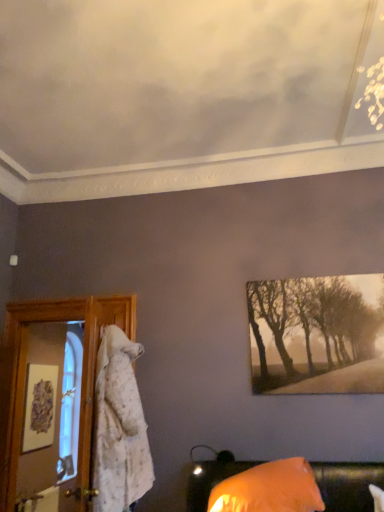
In order to face orange fabric pillow at lower right, should I rotate leftwards or rightwards?

You should look right and rotate roughly 8.987 degrees.

You are a GUI agent. You are given a task and a screenshot of the screen. Output one action in this format:
    pyautogui.click(x=<x>, y=<y>)
    Task: Click on the sepia-toned canvas at upper right
    The height and width of the screenshot is (512, 384).
    Given the screenshot: What is the action you would take?
    pyautogui.click(x=317, y=335)

Locate an element on the screen. matte white picture frame at left is located at coordinates (40, 407).

The image size is (384, 512). I want to click on furniture on the left side of sepia-toned canvas at upper right, so click(346, 484).

Does sepia-toned canvas at upper right have a greater width compared to orange fabric pillow at lower right?

Incorrect, the width of sepia-toned canvas at upper right does not surpass that of orange fabric pillow at lower right.

Measure the distance from sepia-toned canvas at upper right to orange fabric pillow at lower right.

sepia-toned canvas at upper right and orange fabric pillow at lower right are 30.37 inches apart.

Who is taller, sepia-toned canvas at upper right or orange fabric pillow at lower right?

sepia-toned canvas at upper right.

Who is bigger, matte white picture frame at left or sepia-toned canvas at upper right?

With larger size is sepia-toned canvas at upper right.

Could you tell me if matte white picture frame at left is turned towards sepia-toned canvas at upper right?

Yes, matte white picture frame at left is aimed at sepia-toned canvas at upper right.

Is matte white picture frame at left far away from sepia-toned canvas at upper right?

Absolutely, matte white picture frame at left is distant from sepia-toned canvas at upper right.

Locate an element on the screen. picture frame that appears behind the sepia-toned canvas at upper right is located at coordinates (40, 407).

Find the location of a particular element. Image resolution: width=384 pixels, height=512 pixels. tree above the matte white picture frame at left (from a real-world perspective) is located at coordinates (317, 335).

Is sepia-toned canvas at upper right located outside matte white picture frame at left?

Yes.

Are sepia-toned canvas at upper right and matte white picture frame at left located far from each other?

Yes, sepia-toned canvas at upper right and matte white picture frame at left are quite far apart.

Considering the relative sizes of orange fabric pillow at lower right and sepia-toned canvas at upper right in the image provided, is orange fabric pillow at lower right wider than sepia-toned canvas at upper right?

Yes, orange fabric pillow at lower right is wider than sepia-toned canvas at upper right.

From a real-world perspective, which object stands above the other?

sepia-toned canvas at upper right.

How different are the orientations of orange fabric pillow at lower right and sepia-toned canvas at upper right in degrees?

They differ by 0.468 degrees in their facing directions.

Are orange fabric pillow at lower right and sepia-toned canvas at upper right beside each other?

They are not placed beside each other.

How distant is orange fabric pillow at lower right from matte white picture frame at left?

orange fabric pillow at lower right is 8.03 feet away from matte white picture frame at left.

From a real-world perspective, is orange fabric pillow at lower right positioned over matte white picture frame at left based on gravity?

No, from a real-world perspective, orange fabric pillow at lower right is not on top of matte white picture frame at left.

Considering the relative positions of orange fabric pillow at lower right and matte white picture frame at left in the image provided, is orange fabric pillow at lower right to the left of matte white picture frame at left from the viewer's perspective?

In fact, orange fabric pillow at lower right is to the right of matte white picture frame at left.

Identify the location of picture frame behind the orange fabric pillow at lower right. (40, 407).

Could you tell me if matte white picture frame at left is turned towards orange fabric pillow at lower right?

No, matte white picture frame at left does not turn towards orange fabric pillow at lower right.

Can you confirm if matte white picture frame at left is taller than orange fabric pillow at lower right?

Correct, matte white picture frame at left is much taller as orange fabric pillow at lower right.

Can you confirm if matte white picture frame at left is thinner than orange fabric pillow at lower right?

Yes.

Find the location of a particular element. This screenshot has width=384, height=512. furniture in front of the matte white picture frame at left is located at coordinates (346, 484).

You are a GUI agent. You are given a task and a screenshot of the screen. Output one action in this format:
    pyautogui.click(x=<x>, y=<y>)
    Task: Click on the furniture below the sepia-toned canvas at upper right (from the image's perspective)
    This screenshot has height=512, width=384.
    Given the screenshot: What is the action you would take?
    pyautogui.click(x=346, y=484)

The height and width of the screenshot is (512, 384). In order to click on tree in front of the matte white picture frame at left in this screenshot , I will do `click(317, 335)`.

Considering their positions, is orange fabric pillow at lower right positioned further to matte white picture frame at left than sepia-toned canvas at upper right?

Based on the image, orange fabric pillow at lower right appears to be further to matte white picture frame at left.

Looking at the image, which one is located further to sepia-toned canvas at upper right, orange fabric pillow at lower right or matte white picture frame at left?

matte white picture frame at left lies further to sepia-toned canvas at upper right than the other object.

When comparing their distances from matte white picture frame at left, does sepia-toned canvas at upper right or orange fabric pillow at lower right seem closer?

Among the two, sepia-toned canvas at upper right is located nearer to matte white picture frame at left.

Looking at the image, which one is located further to sepia-toned canvas at upper right, matte white picture frame at left or orange fabric pillow at lower right?

Based on the image, matte white picture frame at left appears to be further to sepia-toned canvas at upper right.

Which object lies further to the anchor point orange fabric pillow at lower right, matte white picture frame at left or sepia-toned canvas at upper right?

Based on the image, matte white picture frame at left appears to be further to orange fabric pillow at lower right.

Based on their spatial positions, is sepia-toned canvas at upper right or matte white picture frame at left further from orange fabric pillow at lower right?

matte white picture frame at left is positioned further to the anchor orange fabric pillow at lower right.

Locate an element on the screen. The width and height of the screenshot is (384, 512). furniture located between matte white picture frame at left and sepia-toned canvas at upper right in the left-right direction is located at coordinates (346, 484).